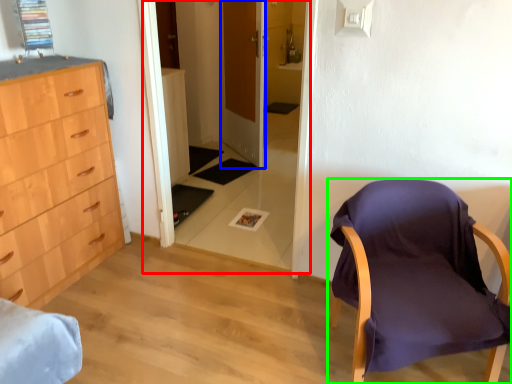
Question: Which object is the farthest from glass door (highlighted by a red box)? Choose among these: door (highlighted by a blue box) or chair (highlighted by a green box).

Choices:
 (A) door
 (B) chair

Answer: (B)